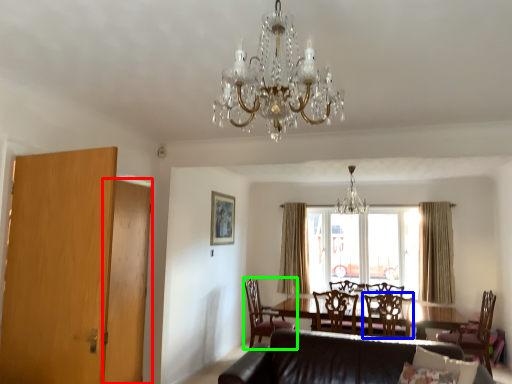
Question: Estimate the real-world distances between objects in this image. Which object is farther from armoire (highlighted by a red box), chair (highlighted by a blue box) or chair (highlighted by a green box)?

Choices:
 (A) chair
 (B) chair

Answer: (B)